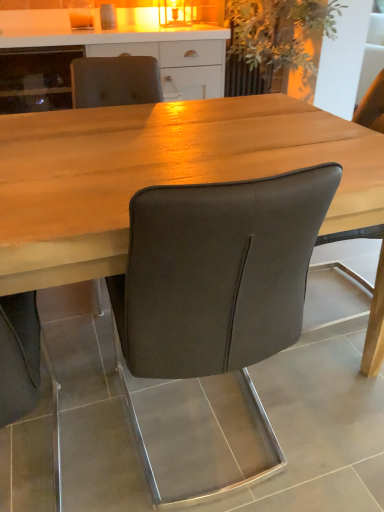
Question: Considering the relative positions of matte white cabinet at upper center and green leafy plant at upper center in the image provided, is matte white cabinet at upper center to the left of green leafy plant at upper center from the viewer's perspective?

Choices:
 (A) no
 (B) yes

Answer: (B)

Question: Can you confirm if matte white cabinet at upper center is positioned to the right of green leafy plant at upper center?

Choices:
 (A) no
 (B) yes

Answer: (A)

Question: From a real-world perspective, is matte white cabinet at upper center on top of green leafy plant at upper center?

Choices:
 (A) yes
 (B) no

Answer: (B)

Question: Is matte white cabinet at upper center turned away from green leafy plant at upper center?

Choices:
 (A) no
 (B) yes

Answer: (A)

Question: Is the position of matte white cabinet at upper center less distant than that of green leafy plant at upper center?

Choices:
 (A) no
 (B) yes

Answer: (A)

Question: Is matte white cabinet at upper center shorter than green leafy plant at upper center?

Choices:
 (A) no
 (B) yes

Answer: (B)

Question: Is wooden table at center bigger than green leafy plant at upper center?

Choices:
 (A) yes
 (B) no

Answer: (A)

Question: Are wooden table at center and green leafy plant at upper center located far from each other?

Choices:
 (A) no
 (B) yes

Answer: (B)

Question: Can you confirm if wooden table at center is wider than green leafy plant at upper center?

Choices:
 (A) no
 (B) yes

Answer: (B)

Question: Is the position of wooden table at center less distant than that of green leafy plant at upper center?

Choices:
 (A) no
 (B) yes

Answer: (B)

Question: From the image's perspective, does wooden table at center appear higher than green leafy plant at upper center?

Choices:
 (A) yes
 (B) no

Answer: (B)

Question: From the image's perspective, is wooden table at center under green leafy plant at upper center?

Choices:
 (A) no
 (B) yes

Answer: (B)

Question: From the image's perspective, does green leafy plant at upper center appear higher than matte white cabinet at upper center?

Choices:
 (A) yes
 (B) no

Answer: (A)